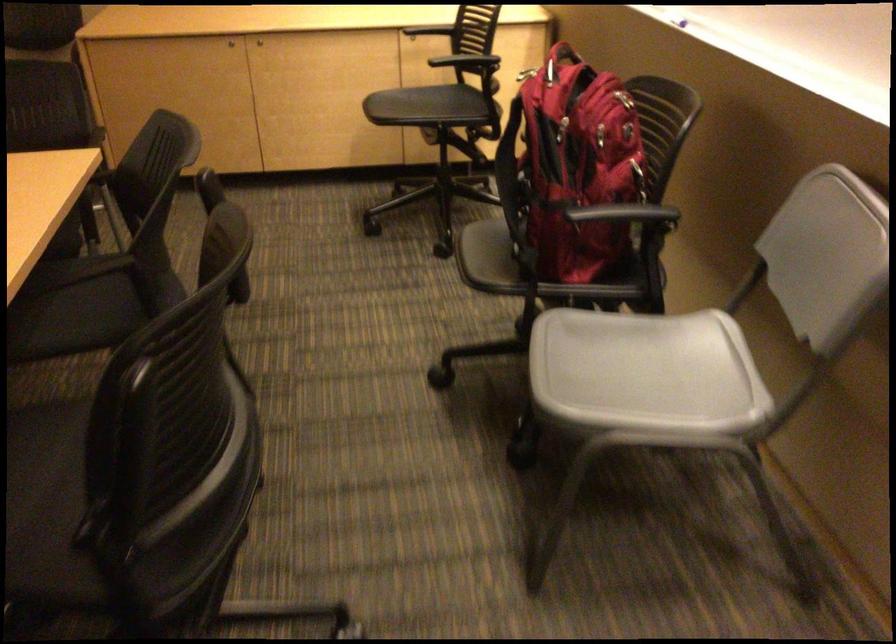
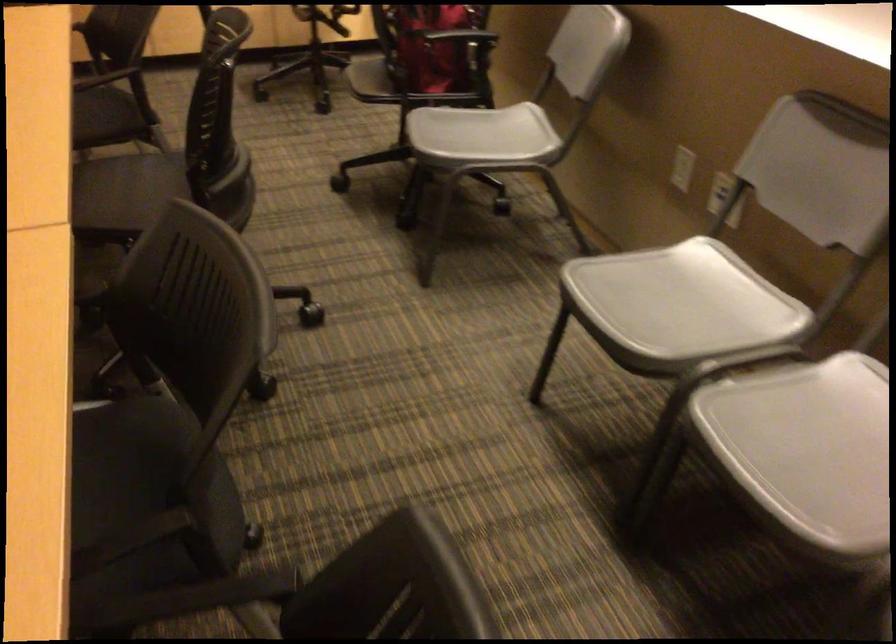
Question: In a continuous first-person perspective shot, in which direction is the camera moving?

Choices:
 (A) Left
 (B) Right
 (C) Forward
 (D) Backward

Answer: (D)